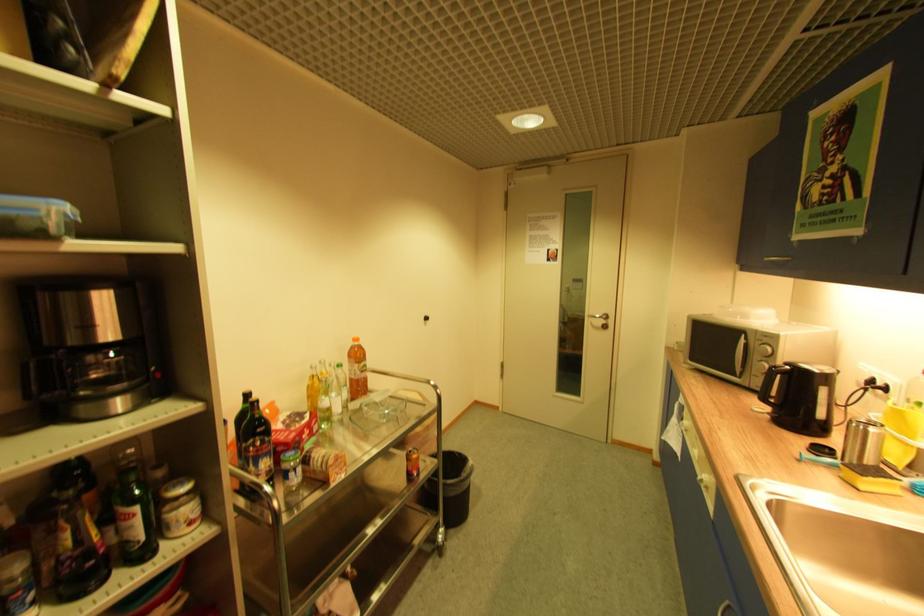
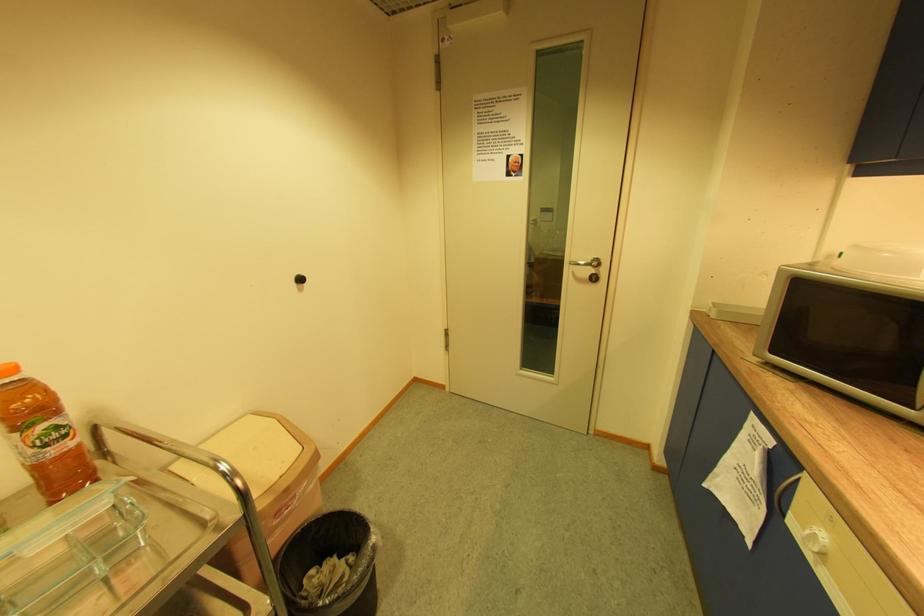
The point at (609,323) is marked in the first image. Where is the corresponding point in the second image?

(598, 272)